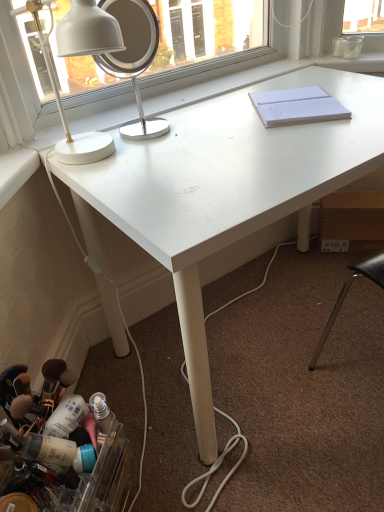
Question: Is white paper notebook at upper right outside white glossy desk lamp at upper left?

Choices:
 (A) yes
 (B) no

Answer: (A)

Question: From a real-world perspective, is white paper notebook at upper right located higher than white glossy desk lamp at upper left?

Choices:
 (A) no
 (B) yes

Answer: (A)

Question: Considering the relative positions of white paper notebook at upper right and white glossy desk lamp at upper left in the image provided, is white paper notebook at upper right in front of white glossy desk lamp at upper left?

Choices:
 (A) no
 (B) yes

Answer: (A)

Question: Can you confirm if white paper notebook at upper right is smaller than white glossy desk lamp at upper left?

Choices:
 (A) no
 (B) yes

Answer: (B)

Question: Would you say white paper notebook at upper right contains white glossy desk lamp at upper left?

Choices:
 (A) no
 (B) yes

Answer: (A)

Question: Is white paper notebook at upper right bigger than white glossy desk lamp at upper left?

Choices:
 (A) yes
 (B) no

Answer: (B)

Question: Considering the relative sizes of white paper notebook at upper right and translucent plastic container at lower left in the image provided, is white paper notebook at upper right bigger than translucent plastic container at lower left?

Choices:
 (A) no
 (B) yes

Answer: (A)

Question: Is white paper notebook at upper right looking in the opposite direction of translucent plastic container at lower left?

Choices:
 (A) yes
 (B) no

Answer: (B)

Question: Would you consider white paper notebook at upper right to be distant from translucent plastic container at lower left?

Choices:
 (A) no
 (B) yes

Answer: (A)

Question: Is white paper notebook at upper right facing towards translucent plastic container at lower left?

Choices:
 (A) yes
 (B) no

Answer: (B)

Question: Would you say translucent plastic container at lower left is part of white paper notebook at upper right's contents?

Choices:
 (A) no
 (B) yes

Answer: (A)

Question: Is white paper notebook at upper right completely or partially outside of translucent plastic container at lower left?

Choices:
 (A) yes
 (B) no

Answer: (A)

Question: From the image's perspective, is white smooth window sill at upper right over white paper notebook at upper right?

Choices:
 (A) no
 (B) yes

Answer: (B)